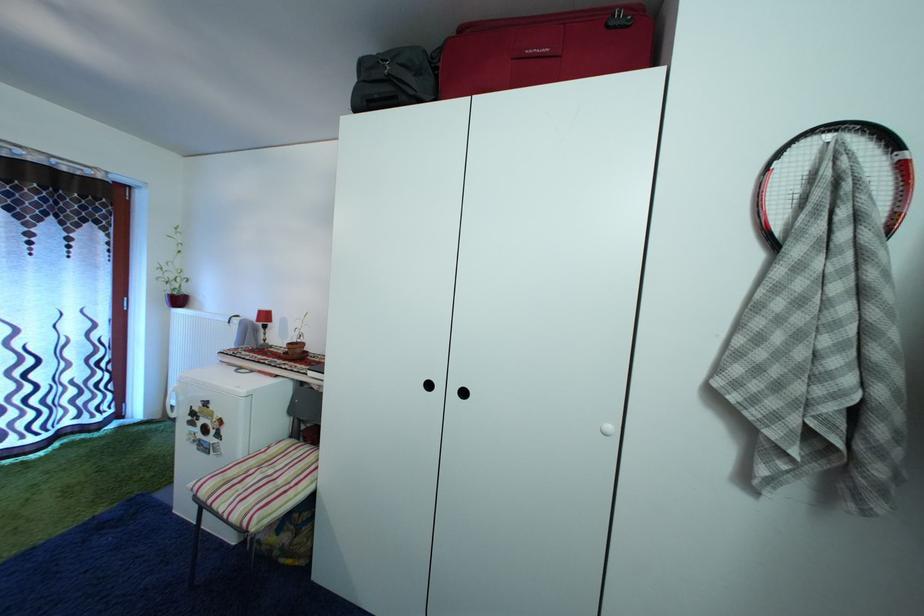
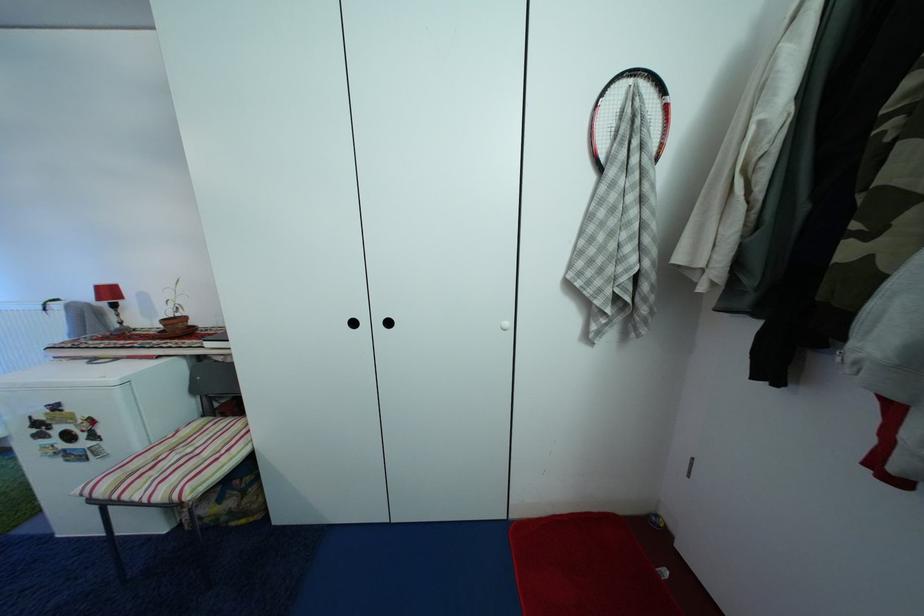
In the second image, find the point that corresponds to point 298,351 in the first image.

(174, 326)